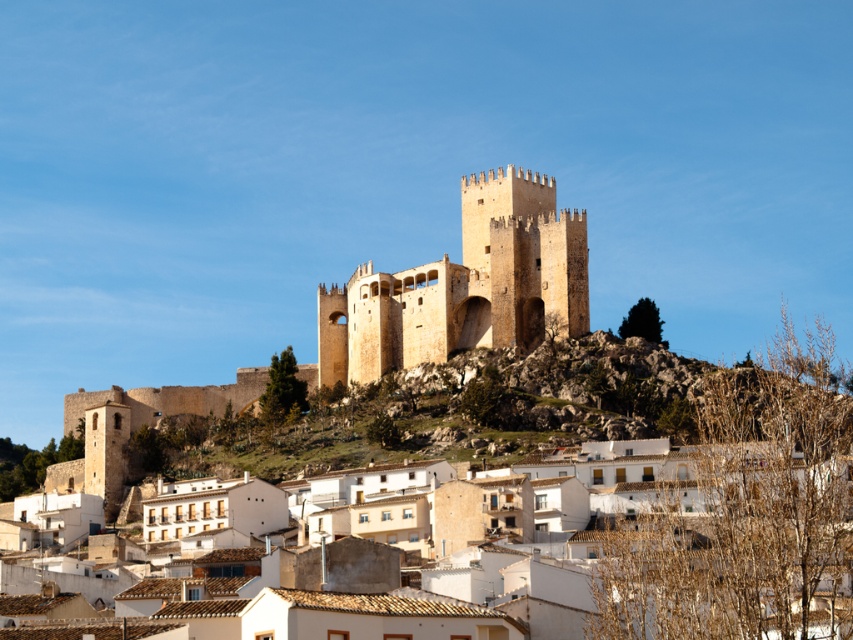
Question: Which object appears closest to the camera in this image?

Choices:
 (A) golden stone castle at center
 (B) light brown stone fort at center
 (C) brown stone tower at center
 (D) white clay houses at center

Answer: (D)

Question: Can you confirm if white clay houses at center is smaller than brown stone tower at center?

Choices:
 (A) no
 (B) yes

Answer: (A)

Question: Based on their relative distances, which object is nearer to the golden stone castle at center?

Choices:
 (A) white clay houses at center
 (B) brown stone tower at center

Answer: (B)

Question: In this image, where is light brown stone fort at center located relative to brown stone tower at center?

Choices:
 (A) left
 (B) right

Answer: (A)

Question: Is golden stone castle at center further to the viewer compared to light brown stone fort at center?

Choices:
 (A) no
 (B) yes

Answer: (A)

Question: Among these points, which one is farthest from the camera?

Choices:
 (A) (390, 288)
 (B) (688, 573)
 (C) (473, 257)
 (D) (329, 292)

Answer: (D)